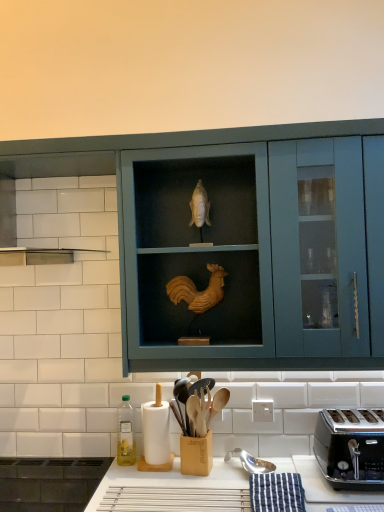
Question: In the image, is black metallic toaster at lower right positioned in front of or behind white matte paper towel at lower left?

Choices:
 (A) front
 (B) behind

Answer: (A)

Question: From their relative heights in the image, would you say black metallic toaster at lower right is taller or shorter than white matte paper towel at lower left?

Choices:
 (A) tall
 (B) short

Answer: (B)

Question: Considering the real-world distances, which object is farthest from the green glass bottle at lower left?

Choices:
 (A) black metallic toaster at lower right
 (B) teal matte cabinet at center
 (C) white matte paper towel at lower left

Answer: (A)

Question: Which of these objects is positioned closest to the black metallic toaster at lower right?

Choices:
 (A) teal matte cabinet at center
 (B) green glass bottle at lower left
 (C) white matte paper towel at lower left

Answer: (A)